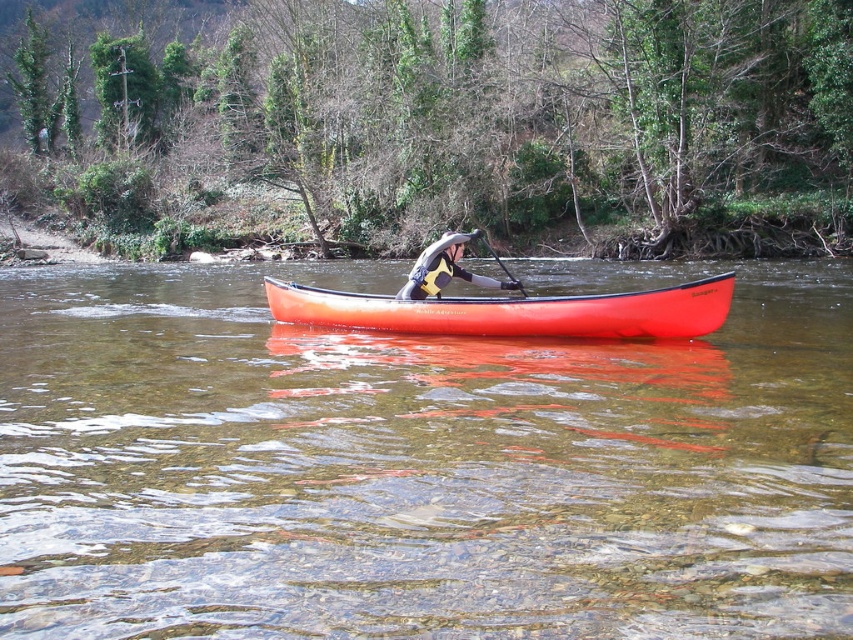
Question: Is the position of transparent plastic canoe at center less distant than that of gray neoprene jacket at center?

Choices:
 (A) no
 (B) yes

Answer: (B)

Question: Does gray neoprene jacket at center appear on the right side of black rubber paddle at center?

Choices:
 (A) no
 (B) yes

Answer: (A)

Question: Estimate the real-world distances between objects in this image. Which object is farther from the gray neoprene jacket at center?

Choices:
 (A) black rubber paddle at center
 (B) orange matte canoe at center

Answer: (B)

Question: Estimate the real-world distances between objects in this image. Which object is farther from the transparent plastic canoe at center?

Choices:
 (A) black rubber paddle at center
 (B) gray neoprene jacket at center

Answer: (A)

Question: Does gray neoprene jacket at center appear on the right side of black rubber paddle at center?

Choices:
 (A) yes
 (B) no

Answer: (B)

Question: Estimate the real-world distances between objects in this image. Which object is closer to the black rubber paddle at center?

Choices:
 (A) gray neoprene jacket at center
 (B) orange matte canoe at center

Answer: (A)